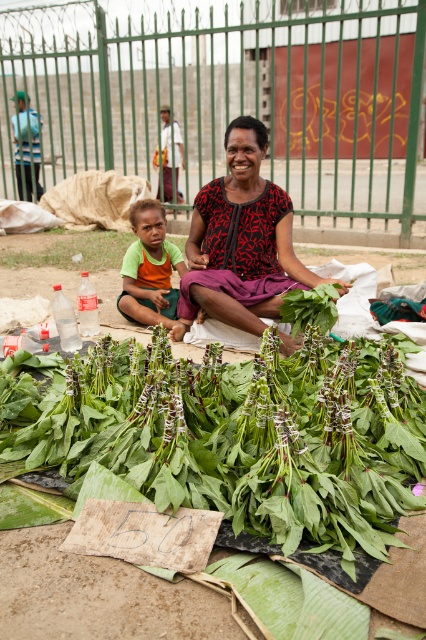
Who is more forward, (x=206, y=305) or (x=132, y=289)?

Positioned in front is point (x=206, y=305).

Is printed fabric blouse at center bigger than green fabric shirt at center?

Yes, printed fabric blouse at center is bigger than green fabric shirt at center.

Is point (261, 257) in front of point (137, 321)?

Yes.

I want to click on printed fabric blouse at center, so click(241, 241).

Is the position of green leafy vegetables at center more distant than that of printed fabric blouse at center?

No, green leafy vegetables at center is in front of printed fabric blouse at center.

Which is above, green leafy vegetables at center or printed fabric blouse at center?

printed fabric blouse at center

Find the location of a particular element. This screenshot has width=426, height=640. green leafy vegetables at center is located at coordinates (241, 435).

Where is `green leafy vegetables at center`? The image size is (426, 640). green leafy vegetables at center is located at coordinates (241, 435).

Which is more to the left, green leafy vegetables at center or green fabric shirt at center?

green fabric shirt at center is more to the left.

Is green leafy vegetables at center wider than green fabric shirt at center?

Indeed, green leafy vegetables at center has a greater width compared to green fabric shirt at center.

Between point (74, 378) and point (141, 320), which one is positioned behind?

Positioned behind is point (141, 320).

Identify the location of green leafy vegetables at center. Image resolution: width=426 pixels, height=640 pixels. (241, 435).